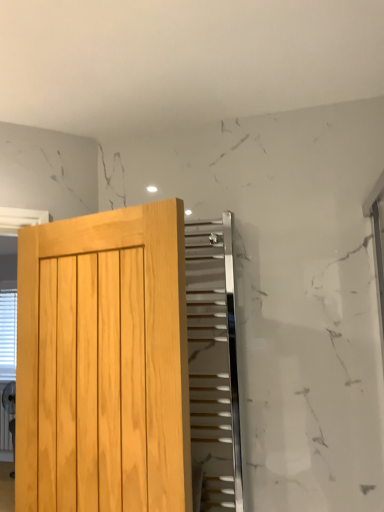
Question: Is polished chrome radiator at upper center wider than light wood door at left?

Choices:
 (A) yes
 (B) no

Answer: (B)

Question: Is polished chrome radiator at upper center facing away from light wood door at left?

Choices:
 (A) yes
 (B) no

Answer: (B)

Question: Does polished chrome radiator at upper center have a lesser width compared to light wood door at left?

Choices:
 (A) yes
 (B) no

Answer: (A)

Question: Is polished chrome radiator at upper center behind light wood door at left?

Choices:
 (A) no
 (B) yes

Answer: (B)

Question: From a real-world perspective, is polished chrome radiator at upper center located higher than light wood door at left?

Choices:
 (A) yes
 (B) no

Answer: (A)

Question: Would you say light wood door at left is part of polished chrome radiator at upper center's contents?

Choices:
 (A) no
 (B) yes

Answer: (A)

Question: Does polished chrome radiator at upper center have a larger size compared to white plastic blinds at left?

Choices:
 (A) yes
 (B) no

Answer: (B)

Question: Is polished chrome radiator at upper center positioned behind white plastic blinds at left?

Choices:
 (A) yes
 (B) no

Answer: (B)

Question: Is polished chrome radiator at upper center not within white plastic blinds at left?

Choices:
 (A) no
 (B) yes

Answer: (B)

Question: Considering the relative positions of polished chrome radiator at upper center and white plastic blinds at left in the image provided, is polished chrome radiator at upper center to the right of white plastic blinds at left from the viewer's perspective?

Choices:
 (A) yes
 (B) no

Answer: (A)

Question: Considering the relative sizes of polished chrome radiator at upper center and white plastic blinds at left in the image provided, is polished chrome radiator at upper center smaller than white plastic blinds at left?

Choices:
 (A) no
 (B) yes

Answer: (B)

Question: Considering the relative sizes of polished chrome radiator at upper center and white plastic blinds at left in the image provided, is polished chrome radiator at upper center wider than white plastic blinds at left?

Choices:
 (A) no
 (B) yes

Answer: (A)

Question: Considering the relative positions of white plastic blinds at left and polished chrome radiator at upper center in the image provided, is white plastic blinds at left to the right of polished chrome radiator at upper center from the viewer's perspective?

Choices:
 (A) no
 (B) yes

Answer: (A)